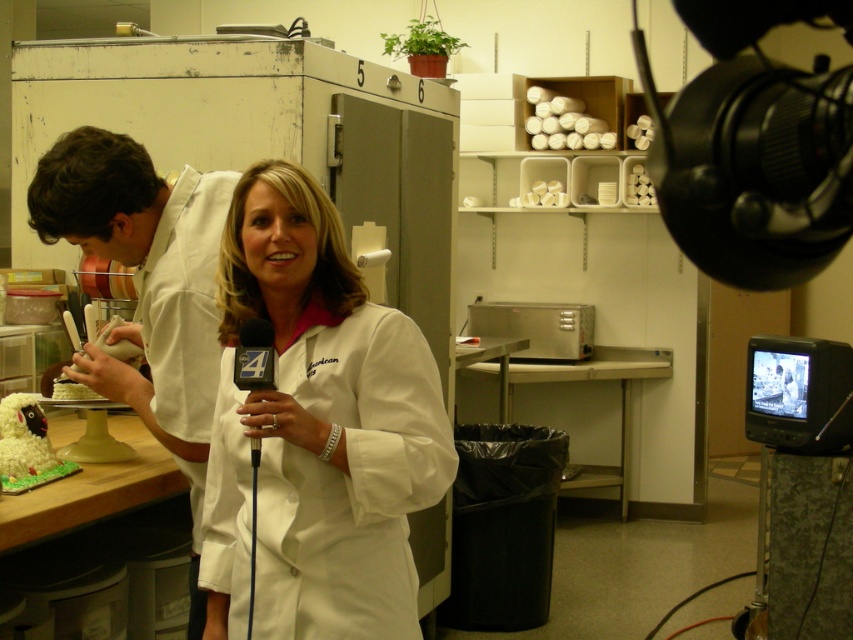
Based on the coordinates provided, can you identify which object corresponds to the point at (148, 289) in the scene?

The point at (148, 289) corresponds to the white matte chef coat at left.

You are a delivery person who needs to place a package between the two points marked as point (271, 634) and another point. The package is 1.5 meters long. Can the package fit between them?

The two points are 1.68 meters apart, so the package which is 1.5 meters long can fit between them as there is enough space.

You are a camera operator adjusting the zoom to focus on the white matte chef coat at left and the black plastic microphone at center. Which object should you zoom in on first to ensure both can fit in the frame without cropping?

The white matte chef coat at left is wider than the black plastic microphone at center, so you should zoom in on the white matte chef coat at left first to accommodate its larger size, ensuring both objects fit in the frame.